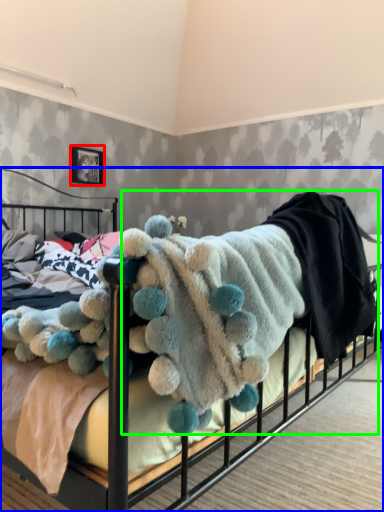
Question: Which object is positioned closest to picture frame (highlighted by a red box)? Select from bed (highlighted by a blue box) and baby clothe (highlighted by a green box).

Choices:
 (A) bed
 (B) baby clothe

Answer: (B)